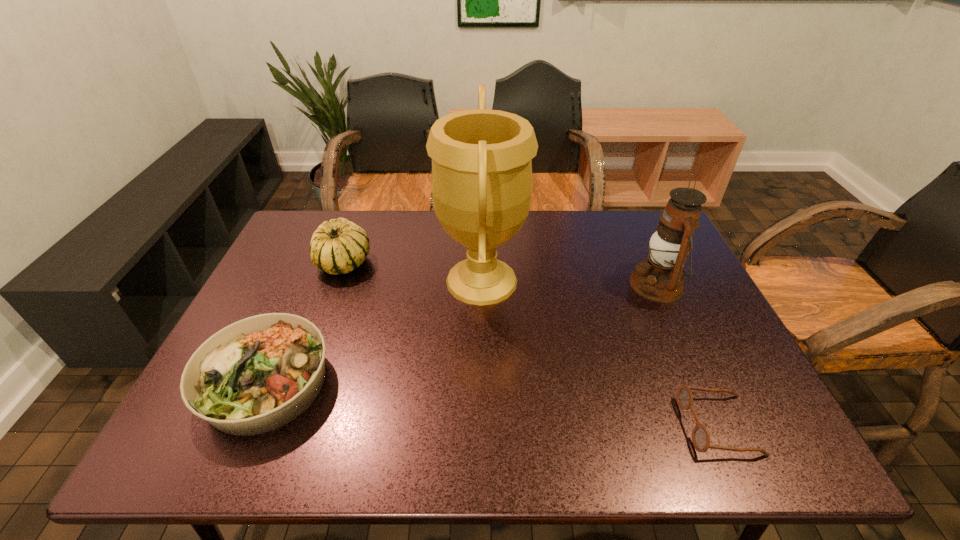
The image size is (960, 540). I want to click on spectacles positioned at the near edge, so tap(700, 436).

Locate an element on the screen. The height and width of the screenshot is (540, 960). gourd present at the left edge is located at coordinates (339, 246).

Locate an element on the screen. The image size is (960, 540). salad plate located at the left edge is located at coordinates (260, 373).

The image size is (960, 540). I want to click on lantern located at the right edge, so click(660, 278).

Image resolution: width=960 pixels, height=540 pixels. What are the coordinates of `spectacles that is at the right edge` in the screenshot? It's located at (700, 436).

This screenshot has width=960, height=540. Find the location of `object that is positioned at the far left corner`. object that is positioned at the far left corner is located at coordinates (339, 246).

This screenshot has width=960, height=540. In order to click on object located in the near left corner section of the desktop in this screenshot , I will do `click(260, 373)`.

At what (x,y) coordinates should I click in order to perform the action: click on object that is positioned at the near right corner. Please return your answer as a coordinate pair (x, y). The width and height of the screenshot is (960, 540). Looking at the image, I should click on (700, 436).

Find the location of `vacant space at the far edge of the desktop`. vacant space at the far edge of the desktop is located at coordinates (444, 237).

Where is `free space at the near edge`? The height and width of the screenshot is (540, 960). free space at the near edge is located at coordinates (315, 443).